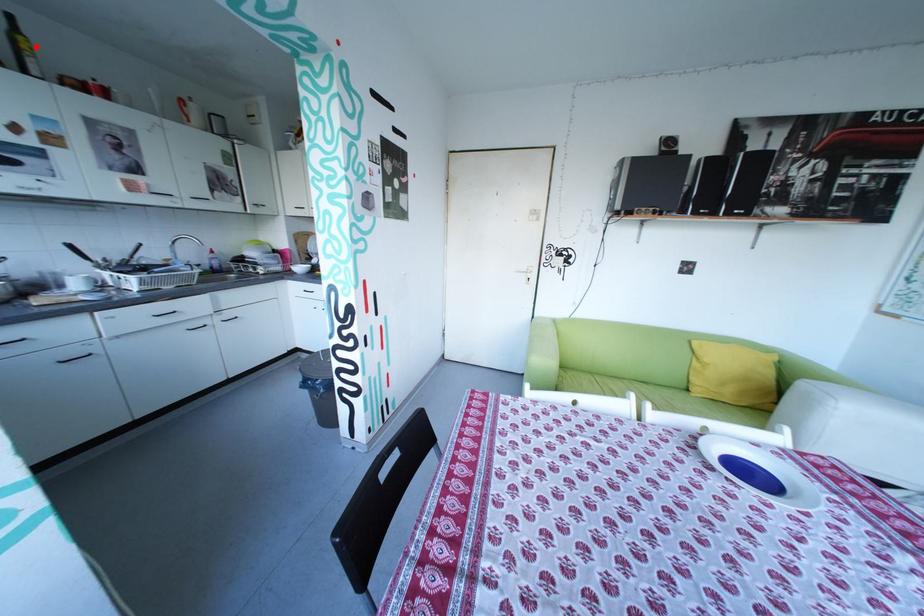
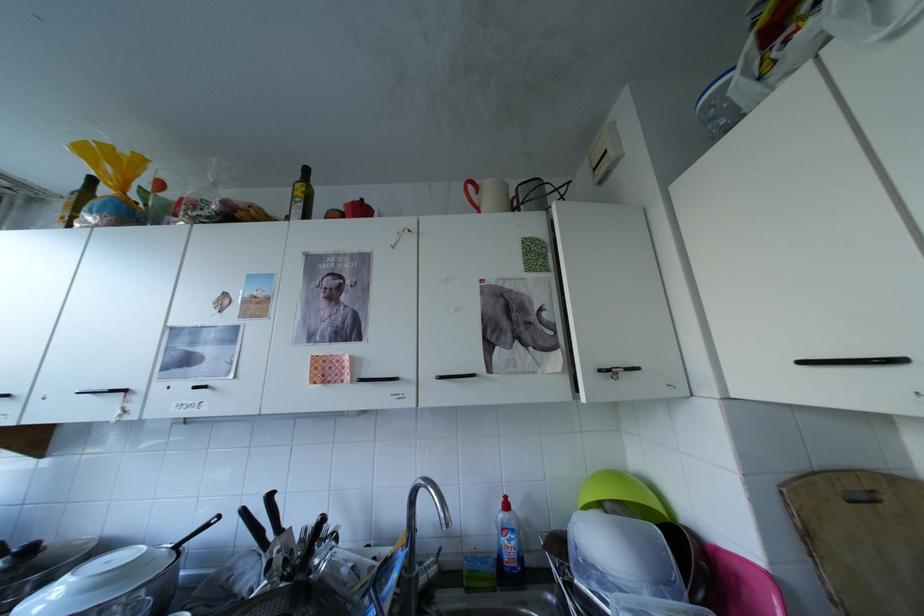
The point at the highlighted location is marked in the first image. Where is the corresponding point in the second image?

(309, 193)